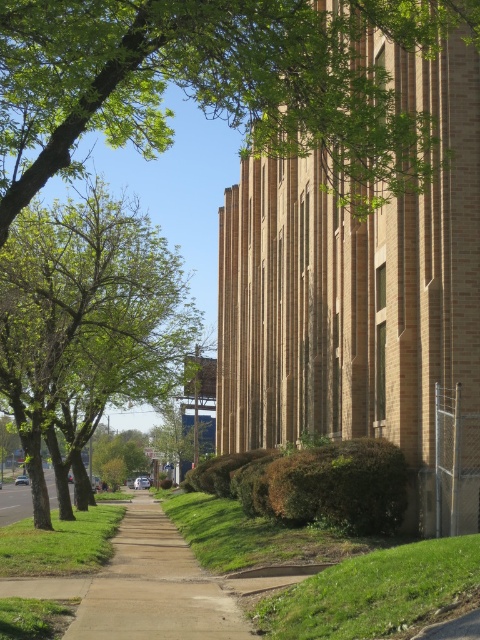
Question: Is green leafy tree at upper left further to the viewer compared to brown concrete sidewalk at center?

Choices:
 (A) yes
 (B) no

Answer: (B)

Question: Is green leafy tree at upper left positioned at the back of green leafy tree at left?

Choices:
 (A) yes
 (B) no

Answer: (B)

Question: Among these objects, which one is nearest to the camera?

Choices:
 (A) green grass at lower left
 (B) green grass at lower center

Answer: (B)

Question: Does green leafy tree at upper left appear over green grass at lower left?

Choices:
 (A) no
 (B) yes

Answer: (B)

Question: Which object is the closest to the green grass at lower center?

Choices:
 (A) green grass at lower left
 (B) green leafy tree at left
 (C) green leafy tree at upper left
 (D) brown concrete sidewalk at center

Answer: (D)

Question: Which of the following is the closest to the observer?

Choices:
 (A) brown concrete sidewalk at center
 (B) green grass at lower left
 (C) green grass at lower center
 (D) green leafy tree at left

Answer: (C)